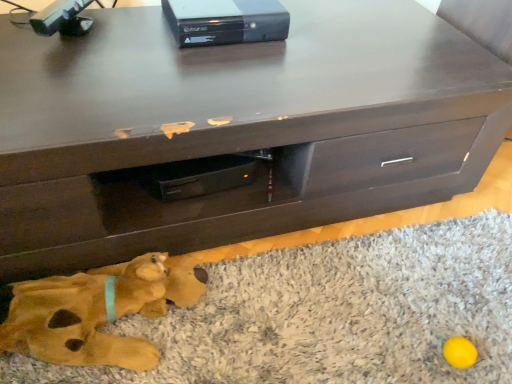
The height and width of the screenshot is (384, 512). Identify the location of unoccupied region to the right of soft plush dog at lower left. (287, 316).